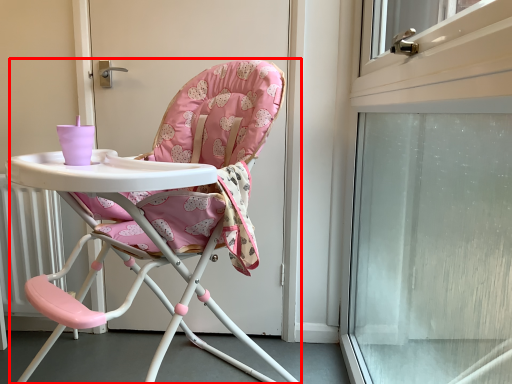
Question: Considering the relative positions of chair (annotated by the red box) and screen door in the image provided, where is chair (annotated by the red box) located with respect to the staircase?

Choices:
 (A) left
 (B) right

Answer: (A)